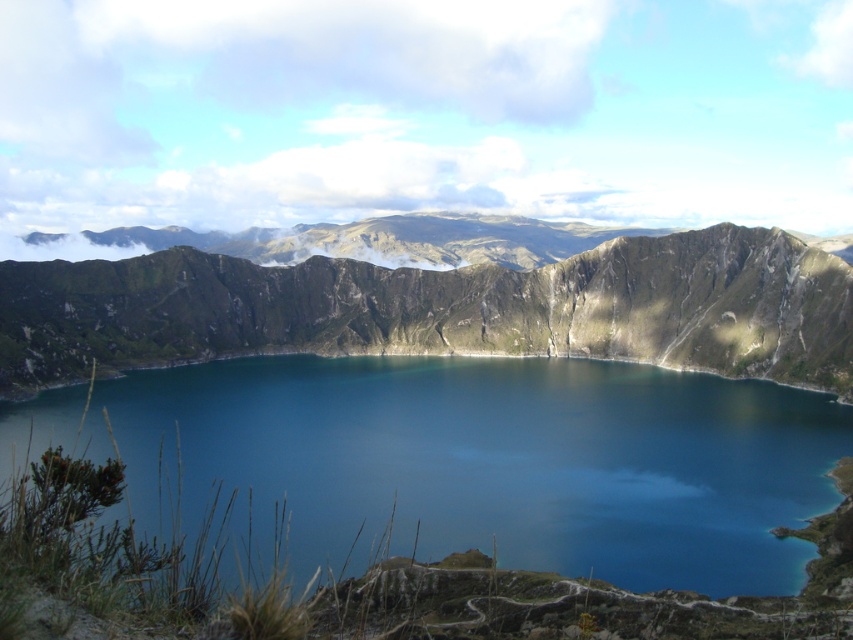
Is point (93, 442) farther from viewer compared to point (318, 264)?

No, it is not.

Describe the element at coordinates (492, 461) in the screenshot. I see `blue glassy water at center` at that location.

The height and width of the screenshot is (640, 853). In order to click on blue glassy water at center in this screenshot , I will do `click(492, 461)`.

Identify the location of blue glassy water at center. (492, 461).